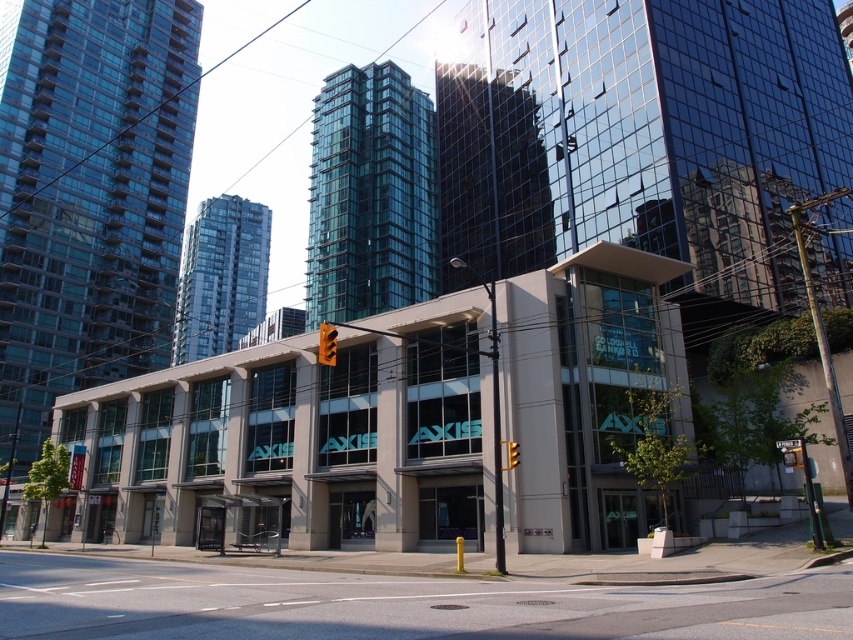
Can you confirm if concrete sidewalk at lower center is smaller than orange plastic traffic light at center?

Yes, concrete sidewalk at lower center is smaller than orange plastic traffic light at center.

Does point (662, 602) lie in front of point (329, 356)?

Yes, it is.

Find the location of a particular element. Image resolution: width=853 pixels, height=640 pixels. concrete sidewalk at lower center is located at coordinates (396, 604).

Can you confirm if orange plastic traffic light at center is positioned to the left of yellow metallic traffic light at center?

Indeed, orange plastic traffic light at center is positioned on the left side of yellow metallic traffic light at center.

Between orange plastic traffic light at center and yellow metallic traffic light at center, which one has more height?

With more height is orange plastic traffic light at center.

You are a GUI agent. You are given a task and a screenshot of the screen. Output one action in this format:
    pyautogui.click(x=<x>, y=<y>)
    Task: Click on the orange plastic traffic light at center
    This screenshot has width=853, height=640.
    Given the screenshot: What is the action you would take?
    pyautogui.click(x=328, y=342)

Find the location of a particular element. The height and width of the screenshot is (640, 853). orange plastic traffic light at center is located at coordinates (328, 342).

Can you confirm if concrete sidewalk at lower center is positioned to the left of yellow metallic traffic light at center?

Correct, you'll find concrete sidewalk at lower center to the left of yellow metallic traffic light at center.

Can you confirm if concrete sidewalk at lower center is taller than yellow metallic traffic light at center?

Yes, concrete sidewalk at lower center is taller than yellow metallic traffic light at center.

Is point (294, 609) behind point (509, 461)?

No, (294, 609) is in front of (509, 461).

Find the location of `concrete sidewalk at lower center`. concrete sidewalk at lower center is located at coordinates tap(396, 604).